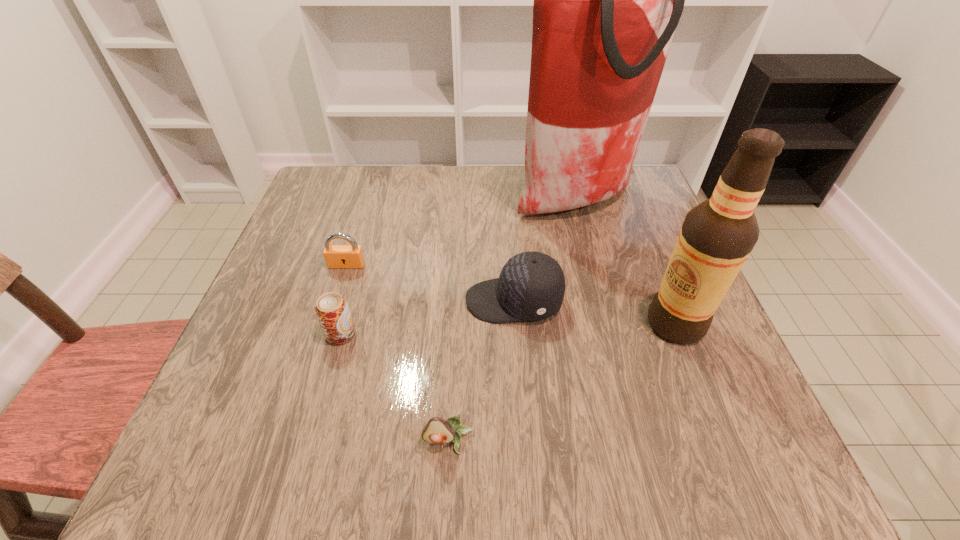
Identify the location of object that ranks as the fifth closest to the grocery bag. The height and width of the screenshot is (540, 960). (438, 430).

Locate an element on the screen. This screenshot has width=960, height=540. free space that satisfies the following two spatial constraints: 1. on the label of the alcohol; 2. on the seed side of the avocado is located at coordinates (723, 441).

Find the location of a particular element. vacant space that satisfies the following two spatial constraints: 1. on the label of the alcohol; 2. on the front side of the beer can is located at coordinates (680, 334).